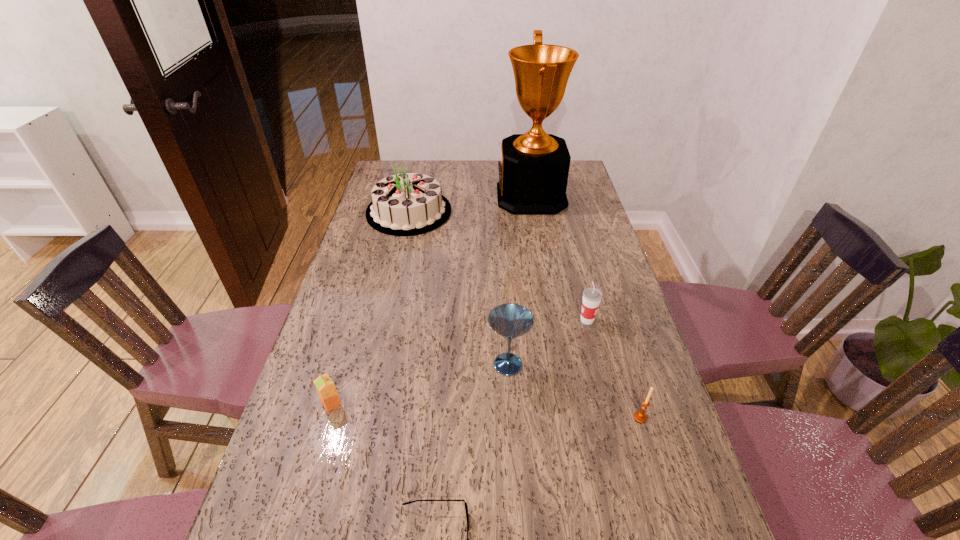
At what (x,y) coordinates should I click in order to perform the action: click on vacant point located between the trophy cup and the fourth nearest object. Please return your answer as a coordinate pair (x, y). Looking at the image, I should click on (519, 281).

Image resolution: width=960 pixels, height=540 pixels. I want to click on free space between the second shortest object and the birthday cake, so click(371, 307).

Locate an element on the screen. This screenshot has width=960, height=540. free space between the fifth shortest object and the birthday cake is located at coordinates (459, 288).

At what (x,y) coordinates should I click in order to perform the action: click on unoccupied position between the trophy cup and the sixth shortest object. Please return your answer as a coordinate pair (x, y). Looking at the image, I should click on (x=470, y=204).

Locate an element on the screen. The height and width of the screenshot is (540, 960). vacant area that lies between the trophy cup and the fourth shortest object is located at coordinates (559, 258).

Where is `free space between the birthday cake and the fifth shortest object`? free space between the birthday cake and the fifth shortest object is located at coordinates (459, 288).

The height and width of the screenshot is (540, 960). I want to click on free space between the third farthest object and the fifth tallest object, so click(613, 369).

Locate which object ranks third in proximity to the birthday cake. Please provide its 2D coordinates. Your answer should be formatted as a tuple, i.e. [(x, y)], where the tuple contains the x and y coordinates of a point satisfying the conditions above.

[(592, 296)]

Where is `object identified as the second closest to the trophy cup`? This screenshot has width=960, height=540. object identified as the second closest to the trophy cup is located at coordinates (592, 296).

Identify the location of vacant space that satisfies the following two spatial constraints: 1. on the side of the third shortest object with the logo; 2. on the right side of the fourth shortest object. 612,417.